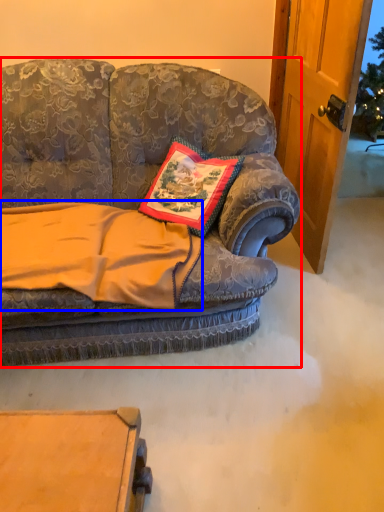
Question: Among these objects, which one is nearest to the camera, studio couch (highlighted by a red box) or blanket (highlighted by a blue box)?

Choices:
 (A) studio couch
 (B) blanket

Answer: (A)